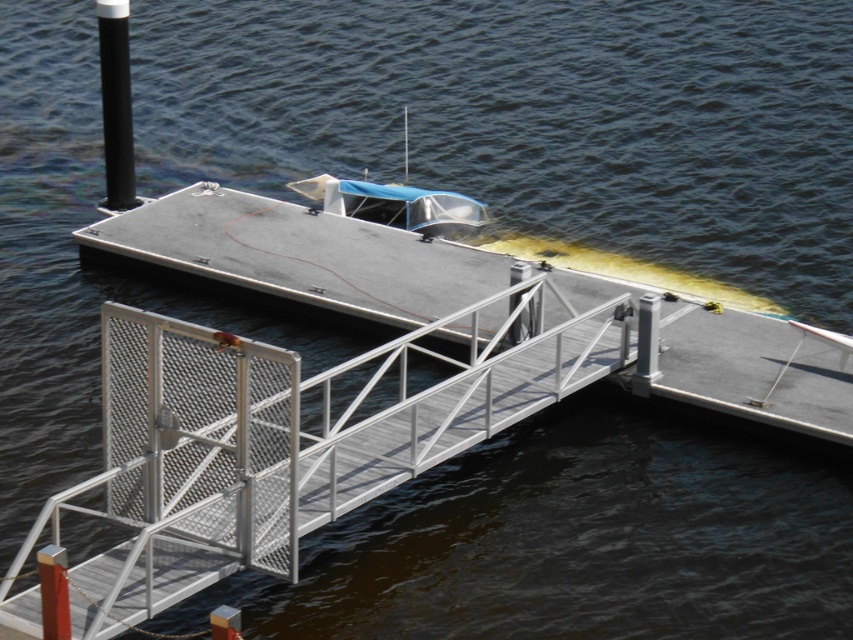
You are standing at the entrance of the dock and want to walk towards the metallic silver rail at center. What direction should you walk to reach it?

Walk straight ahead towards the center of the dock to reach the metallic silver rail at center, as it is positioned at the center point.

You are a delivery person with a cart that is 1.2 meters wide. You need to deliver a package to the dock. The path to the dock is between the metallic gray boat at center and the black matte pole at upper left. Can your cart pass through this path?

The metallic gray boat at center is wider than the black matte pole at upper left. The path between them may be narrower than the boat or pole, but since the boat is wider, the minimum width of the path is determined by the narrower side. However, the question states the cart is 1.2 meters wide. Without exact measurements, we can infer that if the boat is wider, the space between them might still accommodate the cart if the pole is narrower. But according to the description, the boat is wider than the pole,

You are a maintenance worker tasked with checking the height of the metallic silver rail at center and the metallic gray boat at center. Which object has a lower height?

The metallic silver rail at center has a lesser height compared to the metallic gray boat at center, so the metallic silver rail at center is lower in height.